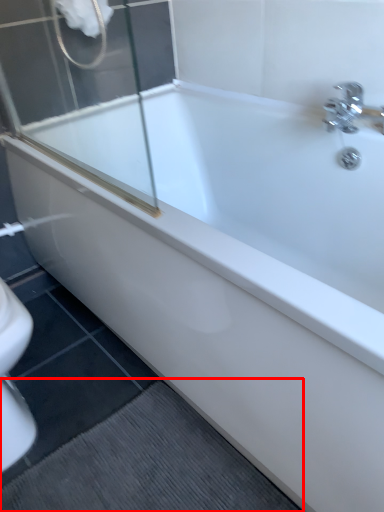
Question: From the image's perspective, considering the relative positions of bath mat (annotated by the red box) and shower in the image provided, where is bath mat (annotated by the red box) located with respect to the staircase?

Choices:
 (A) below
 (B) above

Answer: (A)